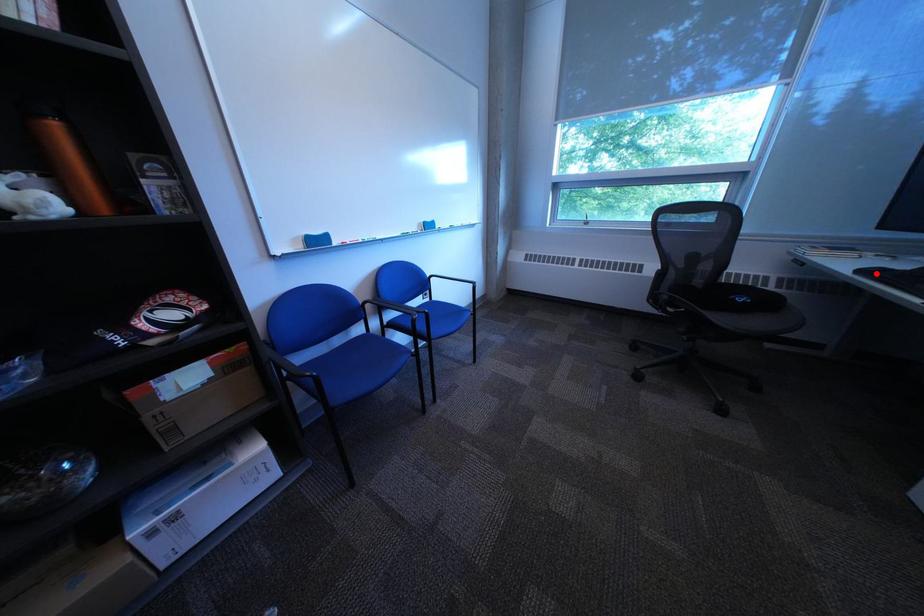
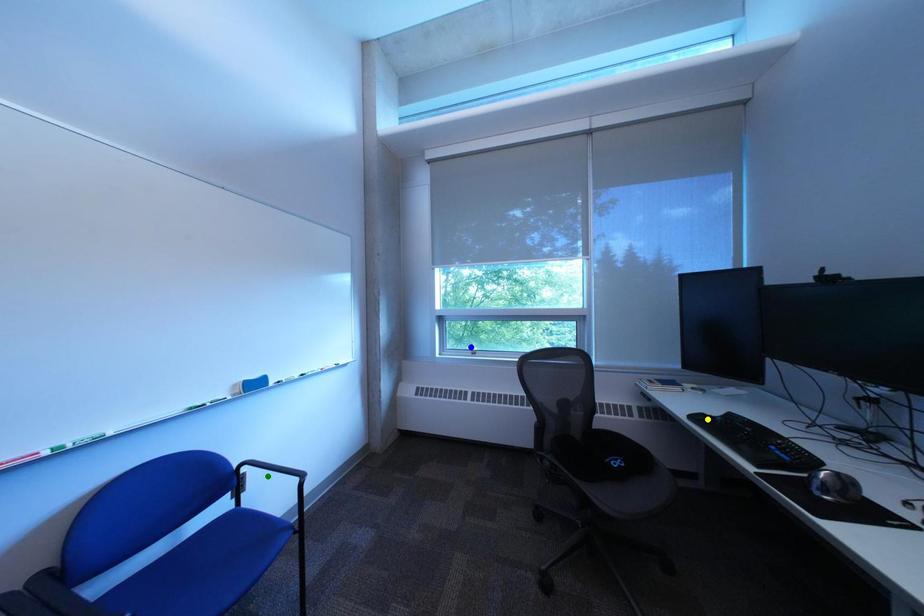
Question: I am providing you with two images of the same scene from different viewpoints. A red point is marked on the first image. You are given multiple points on the second image. Which mark in image 2 goes with the point in image 1?

Choices:
 (A) green point
 (B) yellow point
 (C) blue point

Answer: (B)